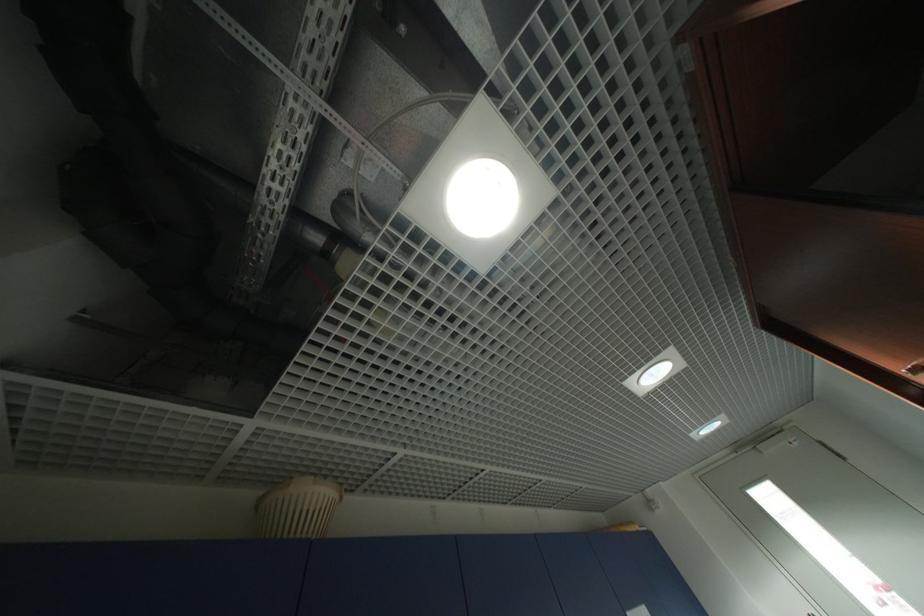
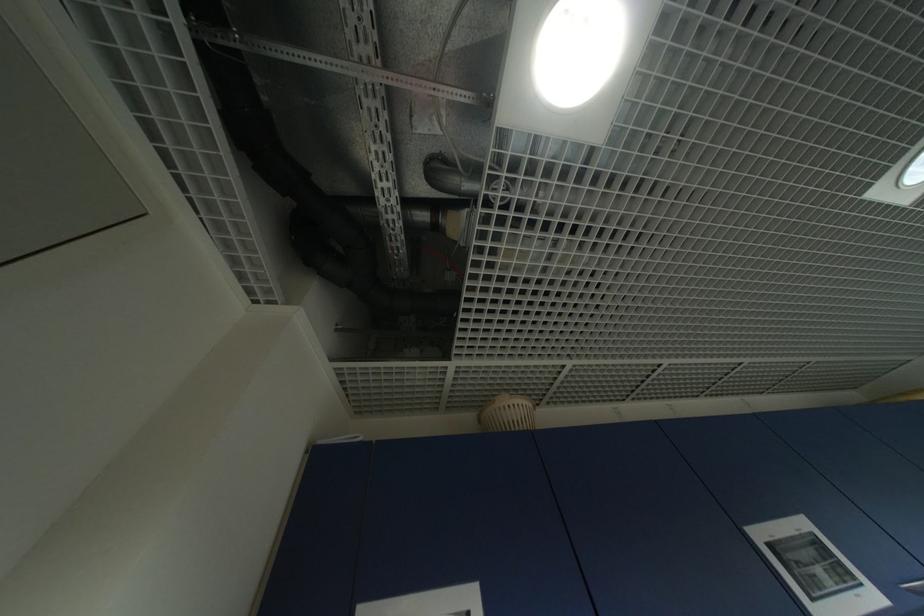
In the second image, find the point that corresponds to pixel 262 509 in the first image.

(485, 422)